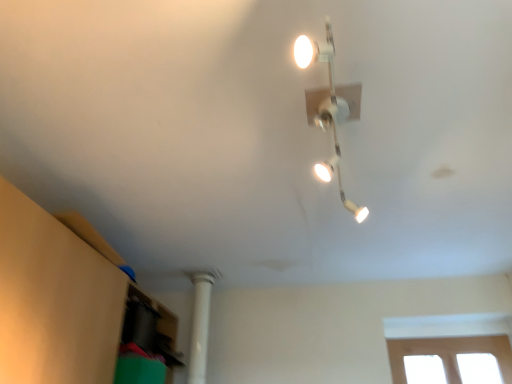
Question: From a real-world perspective, is white glossy track light at upper center located beneath white smooth column at lower left?

Choices:
 (A) no
 (B) yes

Answer: (A)

Question: Is white glossy track light at upper center far from white smooth column at lower left?

Choices:
 (A) yes
 (B) no

Answer: (A)

Question: Is the surface of white glossy track light at upper center in direct contact with white smooth column at lower left?

Choices:
 (A) no
 (B) yes

Answer: (A)

Question: From the image's perspective, is white glossy track light at upper center located above white smooth column at lower left?

Choices:
 (A) yes
 (B) no

Answer: (A)

Question: Considering the relative sizes of white glossy track light at upper center and white smooth column at lower left in the image provided, is white glossy track light at upper center shorter than white smooth column at lower left?

Choices:
 (A) yes
 (B) no

Answer: (A)

Question: Does white glossy track light at upper center come in front of white smooth column at lower left?

Choices:
 (A) yes
 (B) no

Answer: (A)

Question: Does white smooth column at lower left have a larger size compared to white glossy track light at upper center?

Choices:
 (A) no
 (B) yes

Answer: (A)

Question: Considering the relative sizes of white smooth column at lower left and white glossy track light at upper center in the image provided, is white smooth column at lower left taller than white glossy track light at upper center?

Choices:
 (A) no
 (B) yes

Answer: (B)

Question: Is white smooth column at lower left turned away from white glossy track light at upper center?

Choices:
 (A) yes
 (B) no

Answer: (B)

Question: From the image's perspective, is white smooth column at lower left above white glossy track light at upper center?

Choices:
 (A) no
 (B) yes

Answer: (A)

Question: Can you confirm if white smooth column at lower left is shorter than white glossy track light at upper center?

Choices:
 (A) no
 (B) yes

Answer: (A)

Question: Is white smooth column at lower left facing towards white glossy track light at upper center?

Choices:
 (A) yes
 (B) no

Answer: (B)

Question: From the image's perspective, is white glossy track light at upper center above or below white smooth column at lower left?

Choices:
 (A) below
 (B) above

Answer: (B)